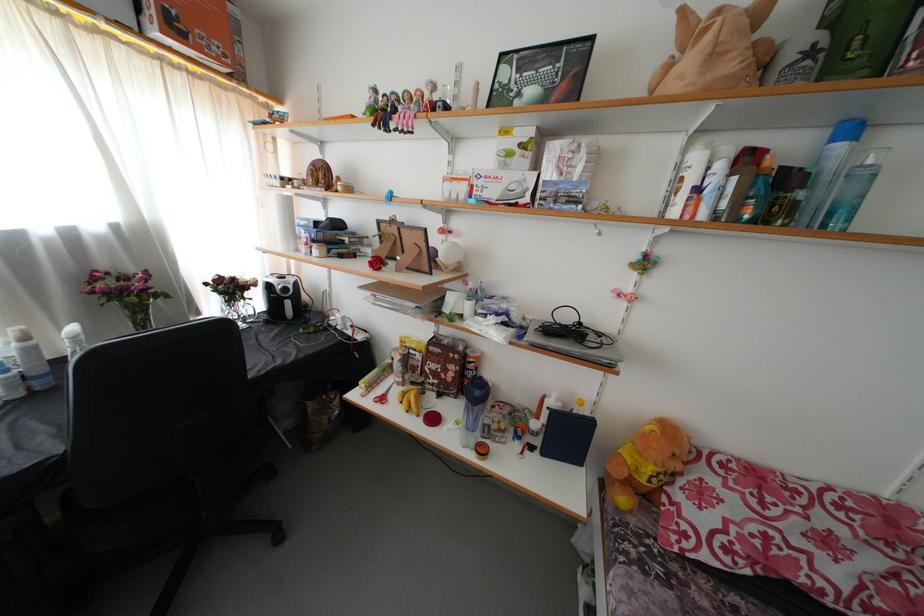
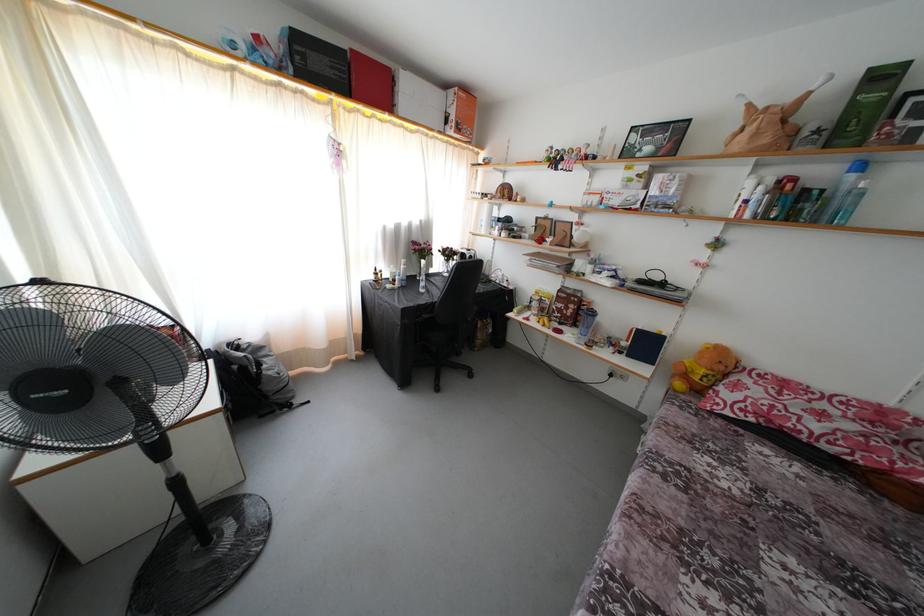
Locate, in the second image, the point that corresponds to the point at 831,138 in the first image.

(849, 172)